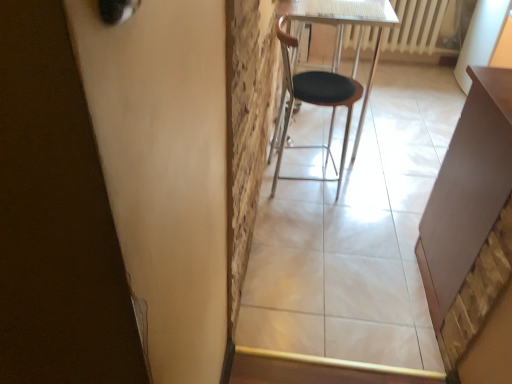
Question: Can you confirm if white plastic radiator at upper right is wider than black leather chair at center?

Choices:
 (A) yes
 (B) no

Answer: (B)

Question: Can you confirm if white plastic radiator at upper right is positioned to the right of black leather chair at center?

Choices:
 (A) yes
 (B) no

Answer: (A)

Question: Is white plastic radiator at upper right turned away from black leather chair at center?

Choices:
 (A) yes
 (B) no

Answer: (B)

Question: Can you confirm if white plastic radiator at upper right is bigger than black leather chair at center?

Choices:
 (A) no
 (B) yes

Answer: (A)

Question: Is there a large distance between white plastic radiator at upper right and black leather chair at center?

Choices:
 (A) yes
 (B) no

Answer: (A)

Question: Considering the positions of black leather chair at center and white plastic radiator at upper right in the image, is black leather chair at center wider or thinner than white plastic radiator at upper right?

Choices:
 (A) wide
 (B) thin

Answer: (A)

Question: In terms of height, does black leather chair at center look taller or shorter compared to white plastic radiator at upper right?

Choices:
 (A) short
 (B) tall

Answer: (B)

Question: Is black leather chair at center spatially inside white plastic radiator at upper right, or outside of it?

Choices:
 (A) inside
 (B) outside

Answer: (B)

Question: From a real-world perspective, relative to white plastic radiator at upper right, is black leather chair at center vertically above or below?

Choices:
 (A) below
 (B) above

Answer: (B)

Question: From a real-world perspective, is white plastic radiator at upper right positioned above or below black leather chair at center?

Choices:
 (A) below
 (B) above

Answer: (A)

Question: Considering their positions, is white plastic radiator at upper right located in front of or behind black leather chair at center?

Choices:
 (A) front
 (B) behind

Answer: (B)

Question: In terms of width, does white plastic radiator at upper right look wider or thinner when compared to black leather chair at center?

Choices:
 (A) wide
 (B) thin

Answer: (B)

Question: From the image's perspective, is white plastic radiator at upper right above or below black leather chair at center?

Choices:
 (A) below
 (B) above

Answer: (B)

Question: Considering their positions, is black leather chair at center located in front of or behind matte brown table at right?

Choices:
 (A) behind
 (B) front

Answer: (A)

Question: From the image's perspective, relative to matte brown table at right, is black leather chair at center above or below?

Choices:
 (A) below
 (B) above

Answer: (B)